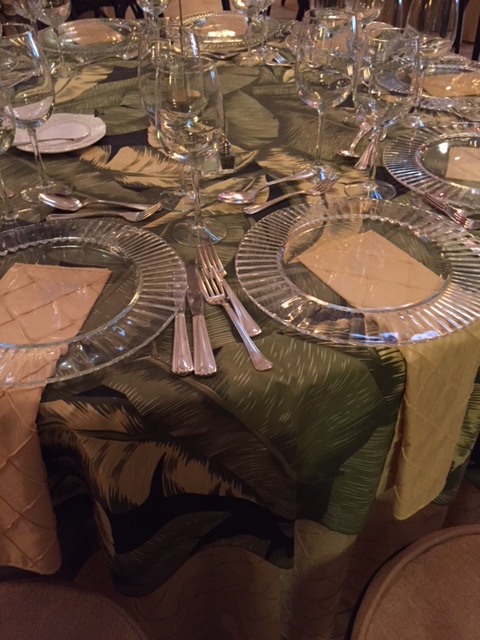
What are the coordinates of `green and white tablecloth with leaf design` in the screenshot? It's located at (311, 380), (220, 186).